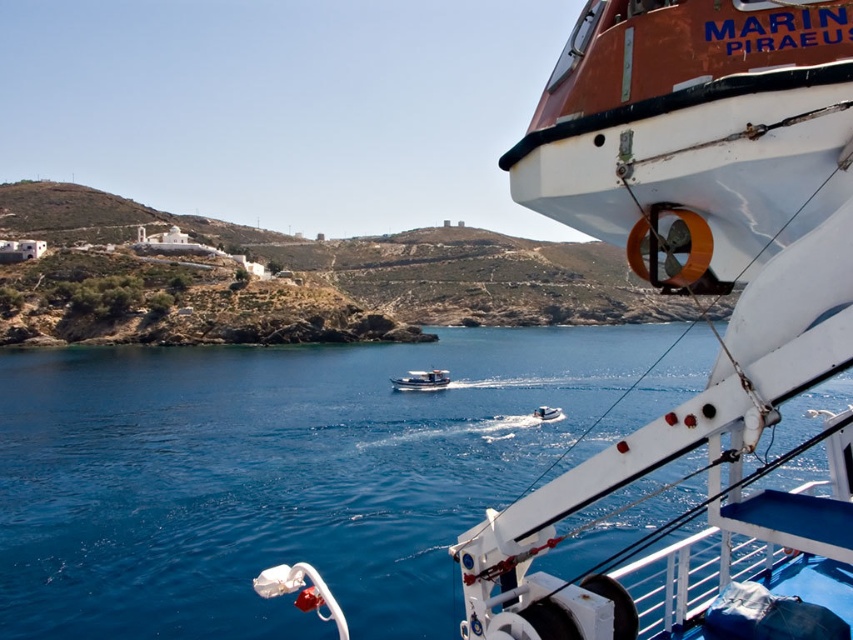
Question: Can you confirm if white glossy motorboat at center is wider than white plastic boat at center?

Choices:
 (A) yes
 (B) no

Answer: (A)

Question: Which point is closer to the camera taking this photo?

Choices:
 (A) [73, 584]
 (B) [538, 419]

Answer: (A)

Question: In this image, where is blue water at center located relative to white plastic boat at center?

Choices:
 (A) left
 (B) right

Answer: (A)

Question: Which is farther from the white plastic boat at center?

Choices:
 (A) white glossy motorboat at center
 (B) blue water at center

Answer: (B)

Question: Which point appears closest to the camera in this image?

Choices:
 (A) (799, 477)
 (B) (560, 408)

Answer: (A)

Question: Observing the image, what is the correct spatial positioning of blue water at center in reference to white plastic boat at center?

Choices:
 (A) right
 (B) left

Answer: (B)